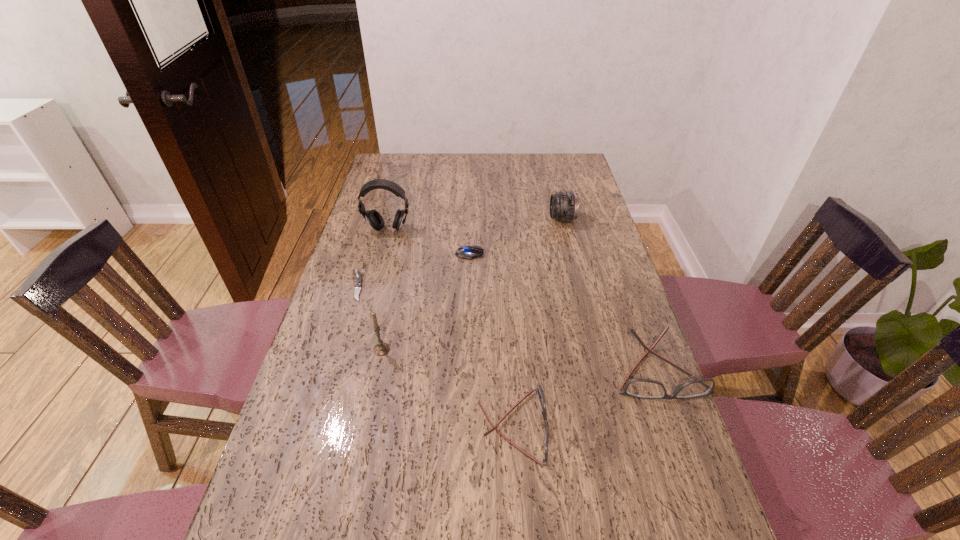
Locate an element on the screen. Image resolution: width=960 pixels, height=540 pixels. vacant area that lies between the second tallest object and the tallest object is located at coordinates (385, 289).

What are the coordinates of `vacant region between the earphone and the right spectacles` in the screenshot? It's located at (522, 299).

The image size is (960, 540). I want to click on vacant space that's between the computer mouse and the telephoto lens, so point(516,237).

Locate an element on the screen. unoccupied area between the tallest object and the candle is located at coordinates (385, 289).

Locate an element on the screen. This screenshot has width=960, height=540. unoccupied area between the right spectacles and the sixth shortest object is located at coordinates (519, 359).

The image size is (960, 540). I want to click on empty location between the shorter spectacles and the sixth shortest object, so click(x=447, y=388).

Locate an element on the screen. The image size is (960, 540). free space between the third tallest object and the candle is located at coordinates (471, 285).

The width and height of the screenshot is (960, 540). In order to click on free space that is in between the tallest object and the fourth farthest object in this screenshot , I will do `click(372, 258)`.

The width and height of the screenshot is (960, 540). I want to click on vacant area that lies between the computer mouse and the telephoto lens, so click(x=516, y=237).

Locate an element on the screen. unoccupied area between the shortest object and the sixth tallest object is located at coordinates (413, 270).